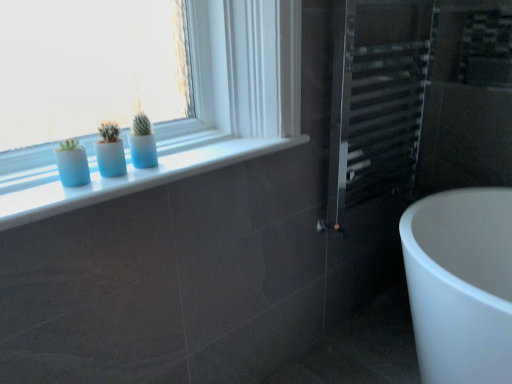
Question: Can you confirm if metallic silver radiator at right is thinner than white glossy window sill at upper center?

Choices:
 (A) no
 (B) yes

Answer: (B)

Question: From the image's perspective, is metallic silver radiator at right on top of white glossy window sill at upper center?

Choices:
 (A) no
 (B) yes

Answer: (B)

Question: Does metallic silver radiator at right come in front of white glossy window sill at upper center?

Choices:
 (A) yes
 (B) no

Answer: (B)

Question: Is metallic silver radiator at right far from white glossy window sill at upper center?

Choices:
 (A) no
 (B) yes

Answer: (A)

Question: Can you confirm if metallic silver radiator at right is taller than white glossy window sill at upper center?

Choices:
 (A) no
 (B) yes

Answer: (B)

Question: From a real-world perspective, is metallic silver radiator at right over white glossy window sill at upper center?

Choices:
 (A) no
 (B) yes

Answer: (A)

Question: Is white glossy window sill at upper center at the right side of matte blue vase at left?

Choices:
 (A) no
 (B) yes

Answer: (B)

Question: From the image's perspective, is white glossy window sill at upper center below matte blue vase at left?

Choices:
 (A) no
 (B) yes

Answer: (A)

Question: Is white glossy window sill at upper center next to matte blue vase at left?

Choices:
 (A) no
 (B) yes

Answer: (A)

Question: Does white glossy window sill at upper center come behind matte blue vase at left?

Choices:
 (A) no
 (B) yes

Answer: (A)

Question: Is white glossy window sill at upper center thinner than matte blue vase at left?

Choices:
 (A) no
 (B) yes

Answer: (A)

Question: From a real-world perspective, is white glossy window sill at upper center positioned over matte blue vase at left based on gravity?

Choices:
 (A) yes
 (B) no

Answer: (B)

Question: Considering the relative sizes of white glossy window sill at upper center and metallic silver radiator at right in the image provided, is white glossy window sill at upper center smaller than metallic silver radiator at right?

Choices:
 (A) no
 (B) yes

Answer: (B)